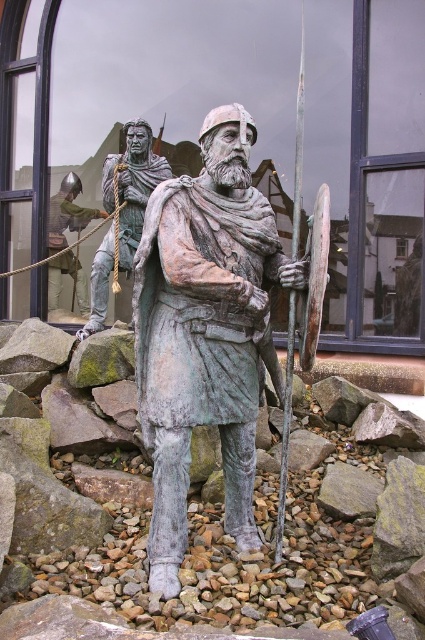
You are a city planner assessing the outdoor space in front of the building. You need to ensure that the bronze statue at center and the bronze warrior at left are visible from the main entrance. Given their sizes, which one is more likely to block the view of the other when viewed from the entrance?

The bronze statue at center is taller than bronze warrior at left, so it is more likely to block the view of the bronze warrior at left when viewed from the entrance.

You are a painter standing 2 meters away from the bronze warrior at left. You want to reach the green fabric rope at upper left to hang a banner. Can you stretch your arm to reach it without moving your feet?

The bronze warrior at left and green fabric rope at upper left are 1.88 meters apart. Since you are already 2 meters away from the bronze warrior at left, the distance to the green fabric rope at upper left would be 2 meters minus 1.88 meters, which is 0.12 meters. However, the total distance from you to the green fabric rope at upper left is actually the sum of your distance to the bronze warrior and the distance between them, so 2 meters plus 1.88 meters equals 3.88 meters. This is likely beyond the reach

You are standing in front of the building and notice the bronze warrior at left and the green fabric rope at upper left. Which object is positioned to the right of the other?

The bronze warrior at left is to the right of green fabric rope at upper left.